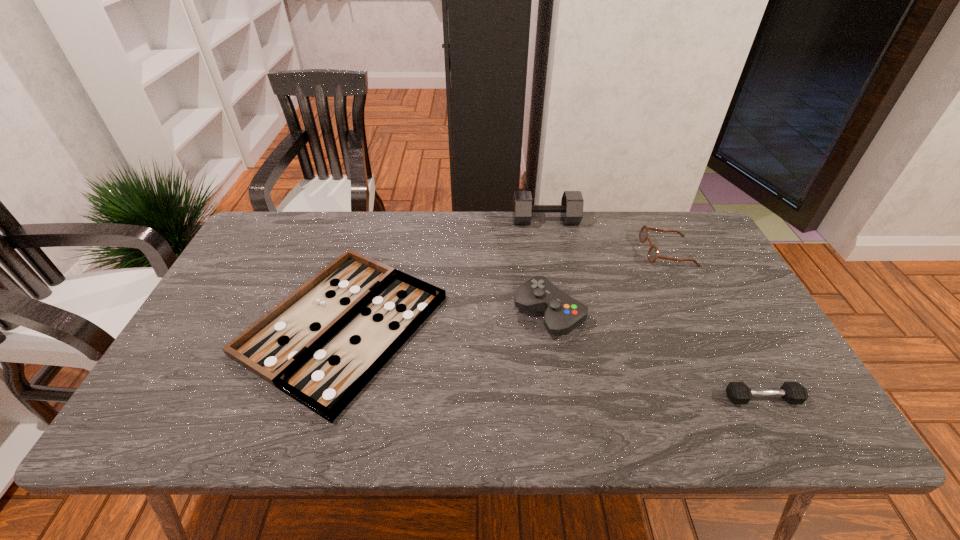
Where is `empty location between the control and the third tallest object`? The width and height of the screenshot is (960, 540). empty location between the control and the third tallest object is located at coordinates (609, 282).

The height and width of the screenshot is (540, 960). I want to click on unoccupied area between the spectacles and the farthest object, so click(607, 236).

Locate which object ranks in proximity to the taller dumbbell. Please provide its 2D coordinates. Your answer should be formatted as a tuple, i.e. [(x, y)], where the tuple contains the x and y coordinates of a point satisfying the conditions above.

[(652, 255)]

Image resolution: width=960 pixels, height=540 pixels. I want to click on the fourth closest object to the shortest object, so click(x=737, y=392).

This screenshot has width=960, height=540. I want to click on vacant space that satisfies the following two spatial constraints: 1. on the front-facing side of the third tallest object; 2. on the front side of the leftmost object, so click(x=704, y=325).

Find the location of a particular element. vacant space that satisfies the following two spatial constraints: 1. on the back side of the nearer dumbbell; 2. on the front-facing side of the spectacles is located at coordinates (684, 252).

Where is `vacant region that satisfies the following two spatial constraints: 1. on the back side of the nearer dumbbell; 2. on the front-facing side of the third tallest object`? The width and height of the screenshot is (960, 540). vacant region that satisfies the following two spatial constraints: 1. on the back side of the nearer dumbbell; 2. on the front-facing side of the third tallest object is located at coordinates (684, 252).

This screenshot has width=960, height=540. In order to click on vacant space that satisfies the following two spatial constraints: 1. on the front-facing side of the nearer dumbbell; 2. on the left side of the spectacles in this screenshot , I will do `click(739, 399)`.